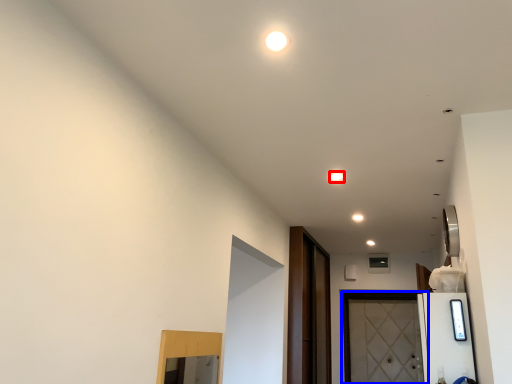
Question: Which object appears closest to the camera in this image, light (highlighted by a red box) or door (highlighted by a blue box)?

Choices:
 (A) light
 (B) door

Answer: (A)